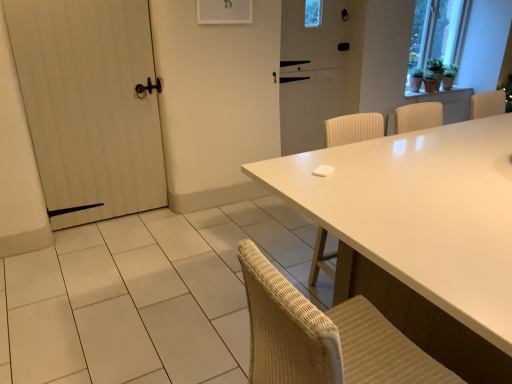
Question: Is white matte screen door at center taller or shorter than white glossy table at center?

Choices:
 (A) tall
 (B) short

Answer: (A)

Question: Based on their sizes in the image, would you say white matte screen door at center is bigger or smaller than white glossy table at center?

Choices:
 (A) big
 (B) small

Answer: (B)

Question: Estimate the real-world distances between objects in this image. Which object is farther from the green matte plant at upper right?

Choices:
 (A) white wooden door at left
 (B) white matte screen door at center
 (C) white glossy table at center

Answer: (A)

Question: Which is farther from the white matte screen door at center?

Choices:
 (A) white wooden door at left
 (B) white glossy table at center
 (C) green matte plant at upper right

Answer: (B)